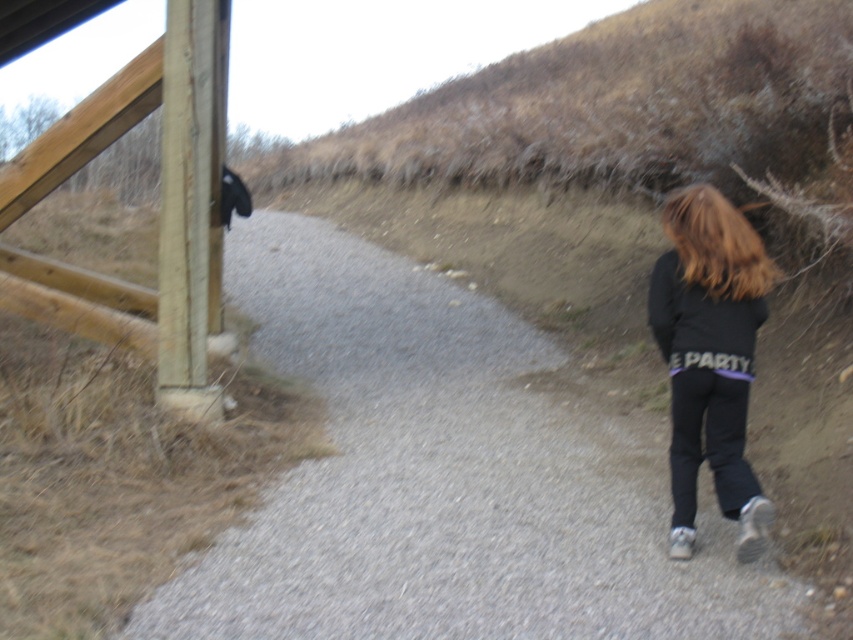
Question: Which point is closer to the camera?

Choices:
 (A) light brown wooden rail at left
 (B) gray gravel path at center

Answer: (B)

Question: Considering the real-world distances, which object is farthest from the light brown wooden rail at left?

Choices:
 (A) gray gravel path at center
 (B) blonde silky hair at right

Answer: (B)

Question: Is light brown wooden rail at left above blonde silky hair at right?

Choices:
 (A) no
 (B) yes

Answer: (B)

Question: Which object is positioned closest to the black matte sweatshirt at lower right?

Choices:
 (A) light brown wooden rail at left
 (B) gray gravel path at center
 (C) black matte pants at right

Answer: (C)

Question: Does gray gravel path at center have a lesser width compared to blonde silky hair at right?

Choices:
 (A) yes
 (B) no

Answer: (B)

Question: Does black matte sweatshirt at lower right have a greater width compared to blonde silky hair at right?

Choices:
 (A) yes
 (B) no

Answer: (A)